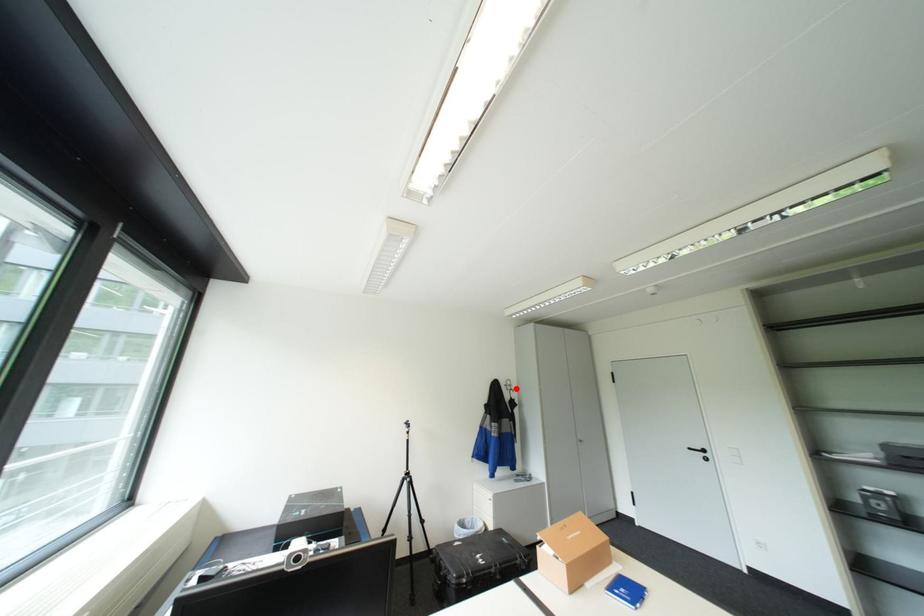
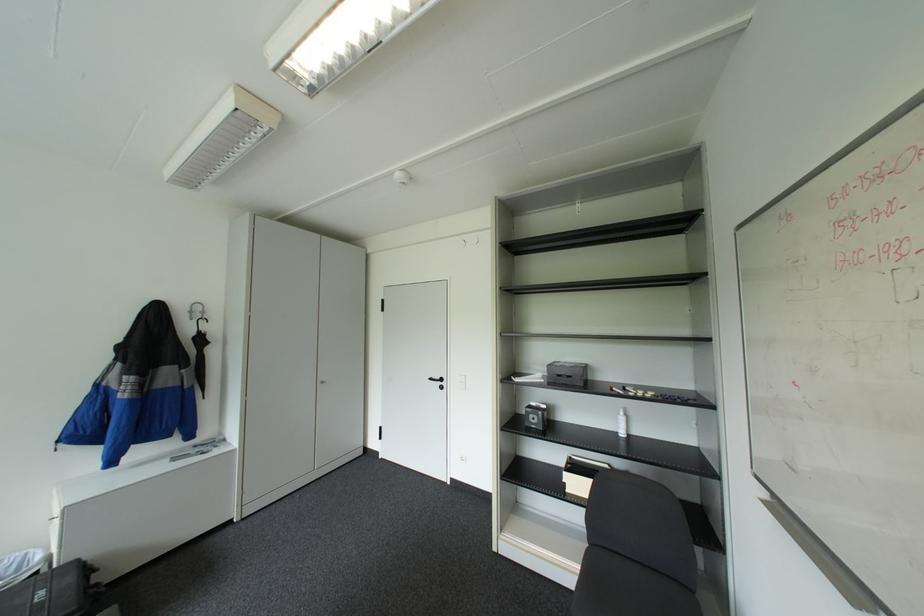
Locate, in the second image, the point that corresponds to the highlighted location in the first image.

(200, 318)